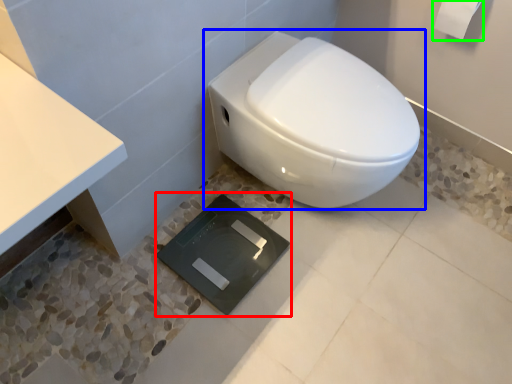
Question: Which object is positioned closest to pad (highlighted by a red box)? Select from toilet (highlighted by a blue box) and toilet paper (highlighted by a green box).

Choices:
 (A) toilet
 (B) toilet paper

Answer: (A)